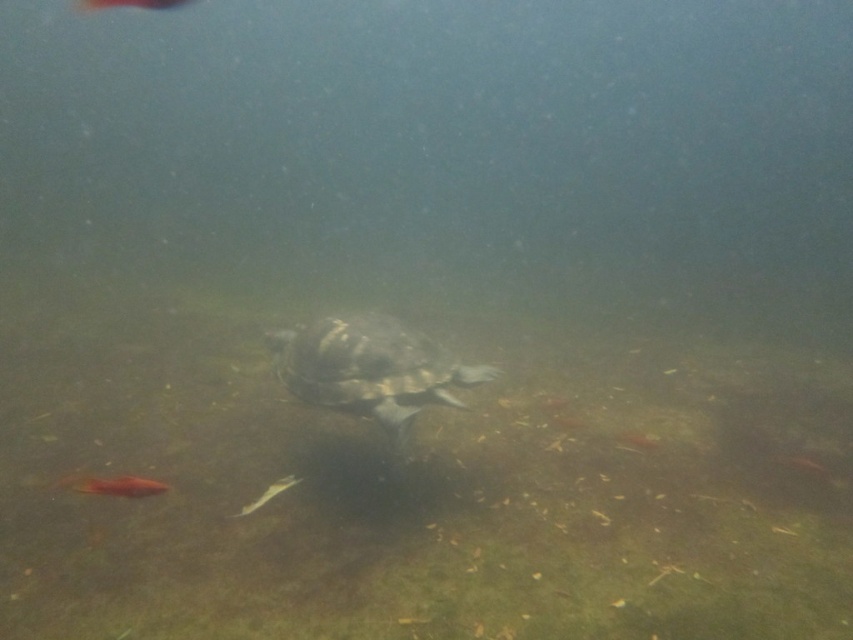
You are an underwater photographer aiming to capture both the translucent orange fish at center and the shiny orange fish at center in a single shot. Since the water is murky, you need to ensure both are within your camera frame. Given their sizes, which fish would require you to adjust your camera closer to fit it in the frame?

The translucent orange fish at center is shorter than the shiny orange fish at center, so you would need to adjust your camera closer to the translucent orange fish at center to fit it in the frame.

You are a diver exploring the underwater scene. You notice two points marked in the image. Which point is closer to you, point (x=143, y=492) or point (x=113, y=3)?

Point (x=143, y=492) is closer to the viewer than point (x=113, y=3).

You are a scuba diver trying to locate a shiny orange fish at center. You see a brown textured shell at center in the same area. Based on their positions, which object is to the left of the other?

The brown textured shell at center is positioned on the right side of shiny orange fish at center, so the shiny orange fish at center is to the left of the brown textured shell at center.